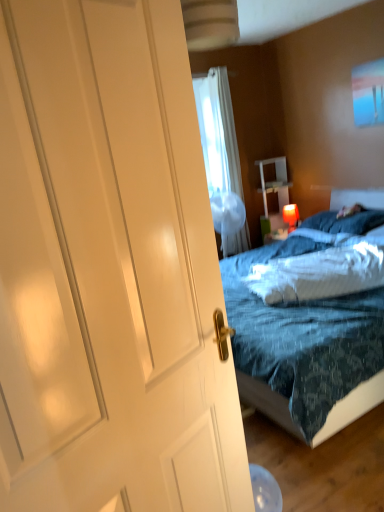
Question: From a real-world perspective, is blue soft pillow at center, which appears as the second pillow when ordered from the bottom, physically below white fluffy pillow at center, which is the first pillow from front to back?

Choices:
 (A) no
 (B) yes

Answer: (B)

Question: Is blue soft pillow at center, which appears as the second pillow when ordered from the bottom, taller than white fluffy pillow at center, arranged as the 2th pillow when viewed from the back?

Choices:
 (A) yes
 (B) no

Answer: (B)

Question: From the image's perspective, is blue soft pillow at center, which is the first pillow in back-to-front order, located above white fluffy pillow at center, placed as the 1th pillow when sorted from bottom to top?

Choices:
 (A) yes
 (B) no

Answer: (A)

Question: Does blue soft pillow at center, which is the 2th pillow from front to back, lie behind white fluffy pillow at center, which is the first pillow from front to back?

Choices:
 (A) yes
 (B) no

Answer: (A)

Question: Does blue soft pillow at center, which is the first pillow in back-to-front order, have a lesser width compared to white fluffy pillow at center, which is the first pillow from front to back?

Choices:
 (A) yes
 (B) no

Answer: (A)

Question: From a real-world perspective, relative to white sheer curtain at upper center, is matte red lampshade at upper right vertically above or below?

Choices:
 (A) below
 (B) above

Answer: (A)

Question: In terms of height, does matte red lampshade at upper right look taller or shorter compared to white sheer curtain at upper center?

Choices:
 (A) tall
 (B) short

Answer: (B)

Question: From the image's perspective, is matte red lampshade at upper right located above or below white sheer curtain at upper center?

Choices:
 (A) below
 (B) above

Answer: (A)

Question: Do you think matte red lampshade at upper right is within white sheer curtain at upper center, or outside of it?

Choices:
 (A) outside
 (B) inside

Answer: (A)

Question: Considering the positions of white glossy nightstand at center and blue soft pillow at center, which is the first pillow in back-to-front order, in the image, is white glossy nightstand at center bigger or smaller than blue soft pillow at center, which is the first pillow in back-to-front order,?

Choices:
 (A) big
 (B) small

Answer: (A)

Question: Is point (284, 188) positioned closer to the camera than point (311, 226)?

Choices:
 (A) farther
 (B) closer

Answer: (A)

Question: From the image's perspective, is white glossy nightstand at center located above or below blue soft pillow at center, which is the first pillow in back-to-front order?

Choices:
 (A) above
 (B) below

Answer: (A)

Question: Would you say white glossy nightstand at center is inside or outside blue soft pillow at center, which ranks as the 1th pillow in top-to-bottom order?

Choices:
 (A) outside
 (B) inside

Answer: (A)

Question: Considering the positions of matte red lampshade at upper right and blue soft pillow at center, which is the 2th pillow from front to back, in the image, is matte red lampshade at upper right wider or thinner than blue soft pillow at center, which is the 2th pillow from front to back,?

Choices:
 (A) wide
 (B) thin

Answer: (B)

Question: Is matte red lampshade at upper right in front of or behind blue soft pillow at center, which appears as the second pillow when ordered from the bottom, in the image?

Choices:
 (A) front
 (B) behind

Answer: (B)